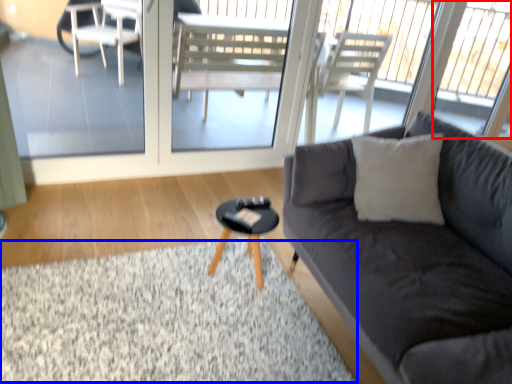
Question: Which point is closer to the camera, window (highlighted by a red box) or flat (highlighted by a blue box)?

Choices:
 (A) window
 (B) flat

Answer: (B)